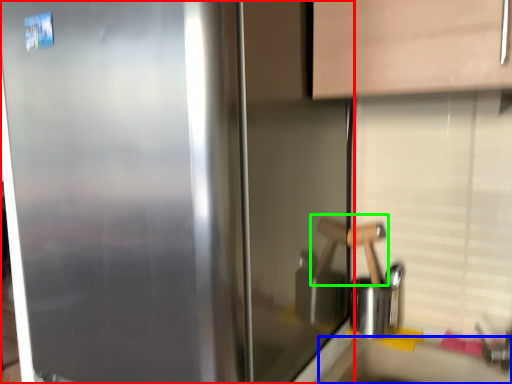
Question: Considering the real-world distances, which object is closest to refrigerator (highlighted by a red box)? counter top (highlighted by a blue box) or door handle (highlighted by a green box).

Choices:
 (A) counter top
 (B) door handle

Answer: (B)